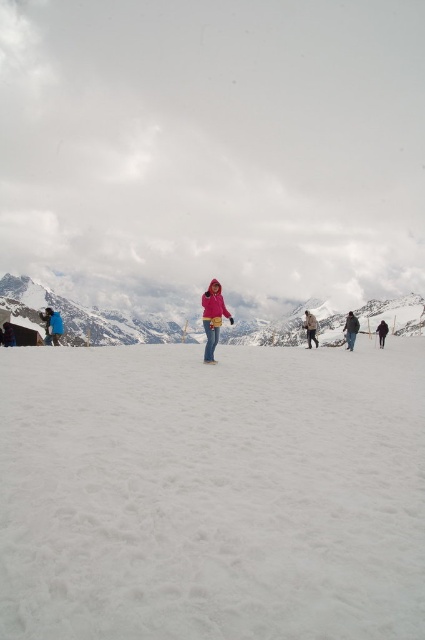
Question: Is pink fleece jacket at center closer to the viewer compared to blue denim jacket at lower left?

Choices:
 (A) yes
 (B) no

Answer: (A)

Question: In this image, where is pink fleece jacket at center located relative to blue fabric jacket at lower left?

Choices:
 (A) above
 (B) below

Answer: (A)

Question: Does pink fleece jacket at center appear over dark gray jacket at right?

Choices:
 (A) yes
 (B) no

Answer: (A)

Question: Which object is the farthest from the white snow at center?

Choices:
 (A) pink fleece jacket at center
 (B) dark gray jacket at right

Answer: (B)

Question: Estimate the real-world distances between objects in this image. Which object is closer to the pink fleece jacket at center?

Choices:
 (A) dark blue jeans at center
 (B) blue fabric jacket at lower left

Answer: (A)

Question: Among these objects, which one is nearest to the camera?

Choices:
 (A) white snow at center
 (B) pink fleece jacket at center
 (C) light brown wool jacket at center

Answer: (A)